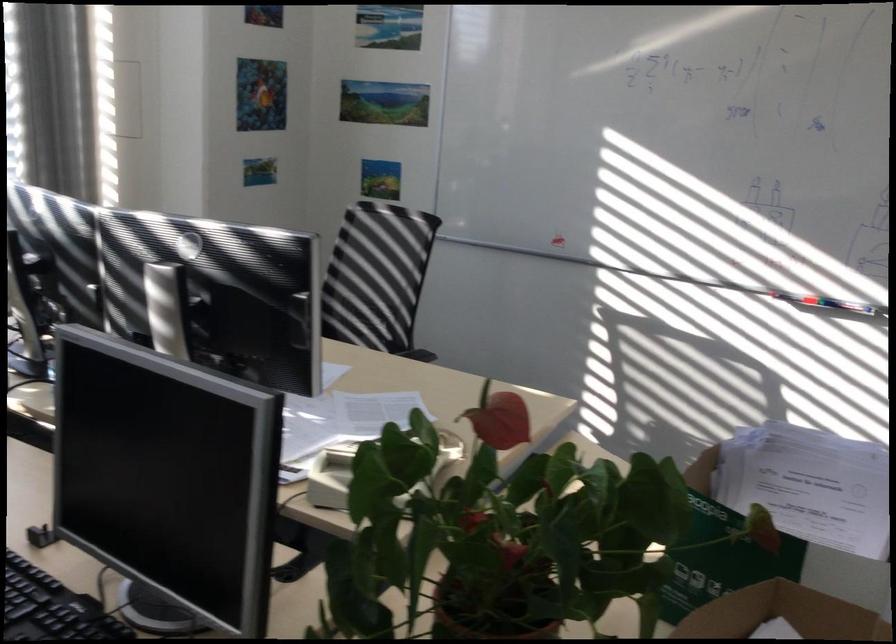
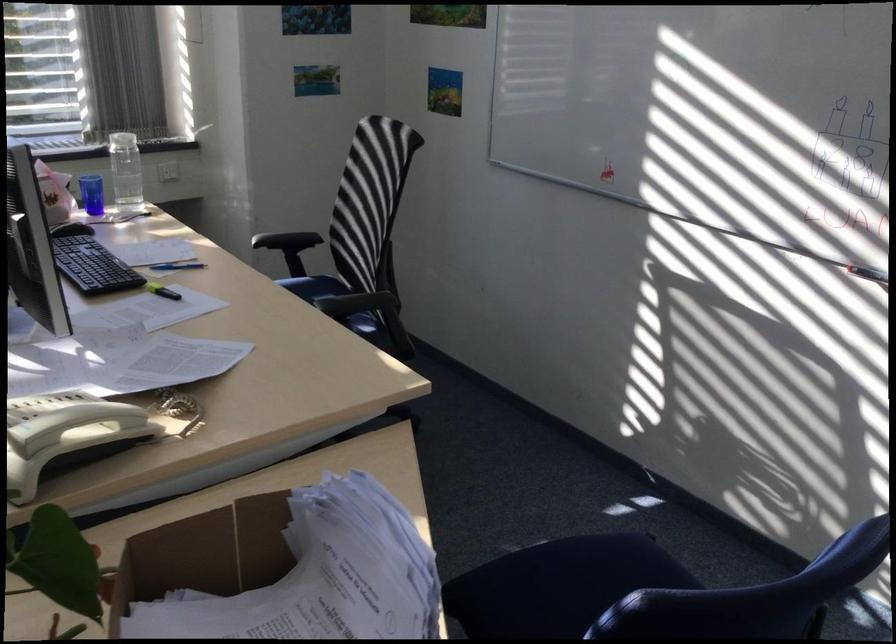
Locate, in the second image, the point that corresponds to the point at 764,493 in the first image.

(319, 576)